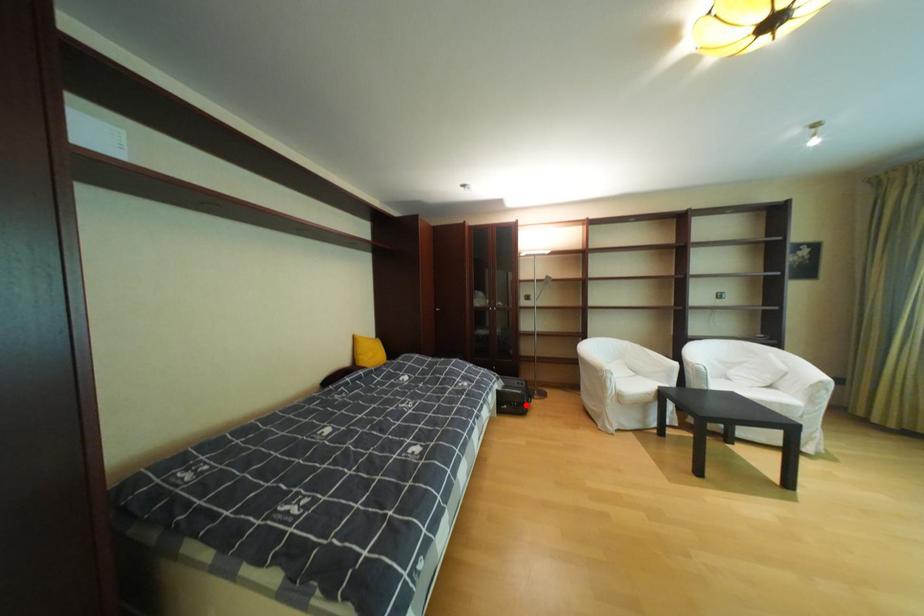
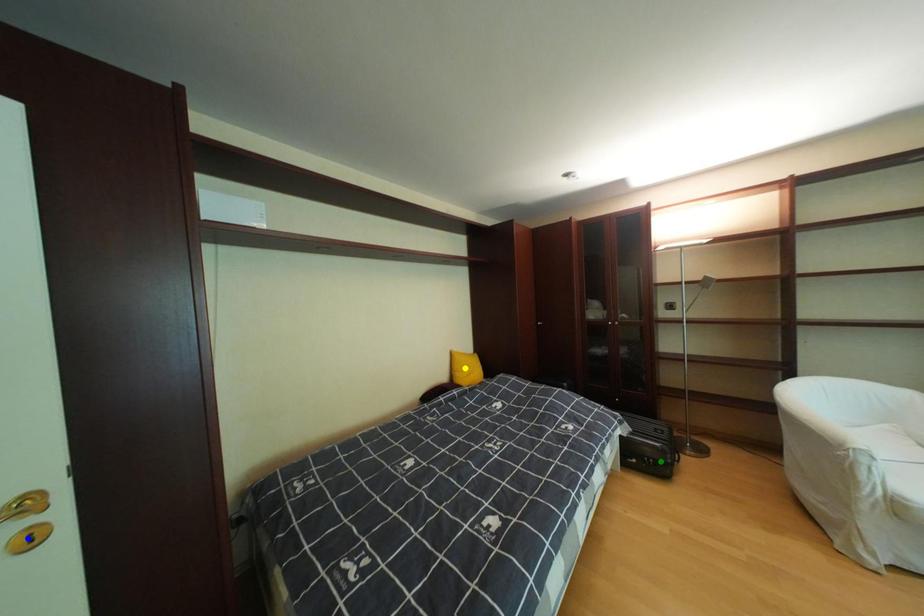
Question: I am providing you with two images of the same scene from different viewpoints. A red point is marked on the first image. You are given multiple points on the second image. Can you choose the point in image 2 that corresponds to the point in image 1?

Choices:
 (A) green point
 (B) blue point
 (C) yellow point

Answer: (A)